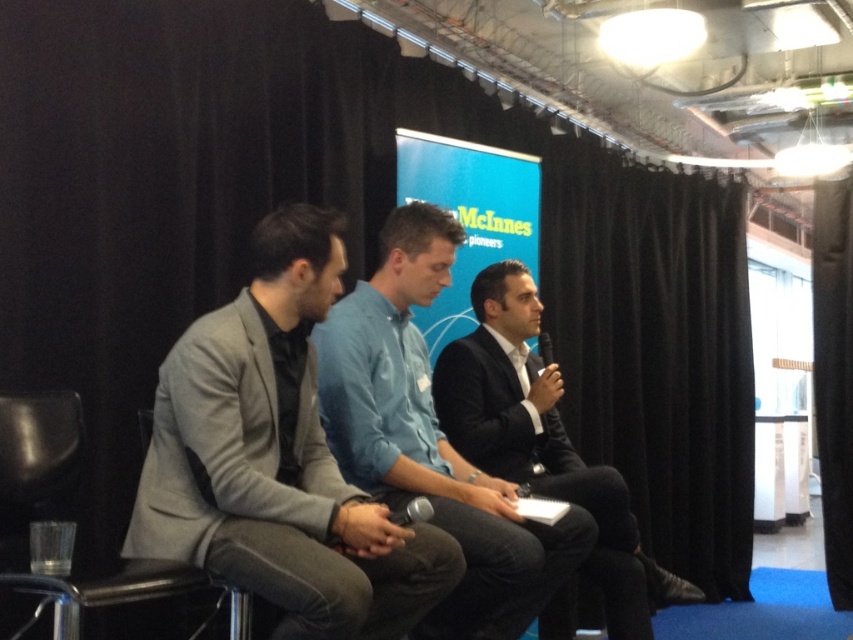
Which is more to the right, gray suit at left or black suit at center?

Positioned to the right is black suit at center.

At what (x,y) coordinates should I click in order to perform the action: click on gray suit at left. Please return your answer as a coordinate pair (x, y). The image size is (853, 640). Looking at the image, I should click on (277, 460).

Can you confirm if black leather chair at left is shorter than black fabric curtain at right?

Yes.

Who is taller, black leather chair at left or black fabric curtain at right?

Standing taller between the two is black fabric curtain at right.

You are a GUI agent. You are given a task and a screenshot of the screen. Output one action in this format:
    pyautogui.click(x=<x>, y=<y>)
    Task: Click on the black leather chair at left
    
    Given the screenshot: What is the action you would take?
    coord(38,444)

Where is `black velvet curtain at upper center`? black velvet curtain at upper center is located at coordinates (654, 349).

Between black velvet curtain at upper center and black suit at center, which one appears on the left side from the viewer's perspective?

black suit at center

Identify the location of black velvet curtain at upper center. (654, 349).